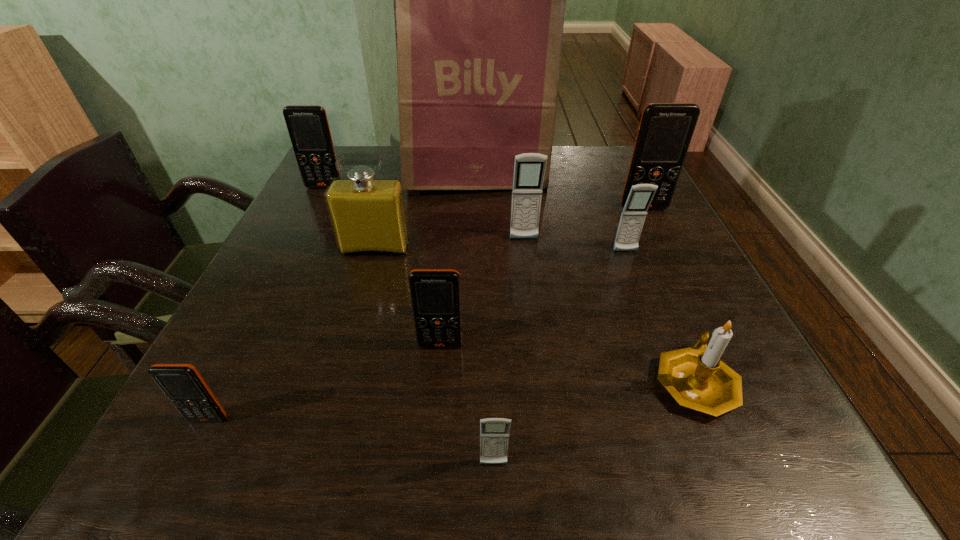
Find the location of a particular element. Image resolution: width=960 pixels, height=540 pixels. the tallest object is located at coordinates (479, 0).

Where is `the third farthest object`? This screenshot has height=540, width=960. the third farthest object is located at coordinates 665,131.

Identify the location of the second tallest object. (665, 131).

Image resolution: width=960 pixels, height=540 pixels. In order to click on perfume in this screenshot , I will do `click(368, 215)`.

Identify the location of the third farthest cellular telephone. (529, 169).

Where is `the second gray cellular telephone from left to right`? This screenshot has height=540, width=960. the second gray cellular telephone from left to right is located at coordinates (529, 169).

Image resolution: width=960 pixels, height=540 pixels. I want to click on the farthest cellular telephone, so click(x=308, y=127).

The height and width of the screenshot is (540, 960). I want to click on the farthest orange cellular telephone, so click(x=308, y=127).

Find the location of a particular element. This screenshot has height=540, width=960. the second smallest gray cellular telephone is located at coordinates (632, 219).

This screenshot has width=960, height=540. Identify the location of the second cellular telephone from right to left. (632, 219).